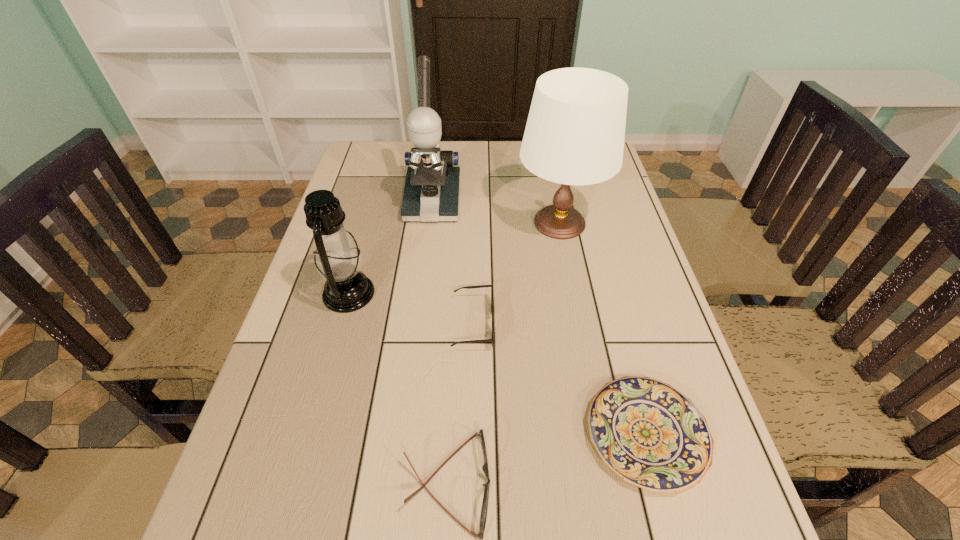
Image resolution: width=960 pixels, height=540 pixels. I want to click on blank area located on the back of the shortest object, so click(x=622, y=347).

Identify the location of object at the left edge. (337, 259).

This screenshot has height=540, width=960. Find the location of `lamp positioned at the right edge`. lamp positioned at the right edge is located at coordinates point(575,131).

At what (x,y) coordinates should I click in order to perform the action: click on plate that is positioned at the right edge. Please return your answer as a coordinate pair (x, y). Image resolution: width=960 pixels, height=540 pixels. Looking at the image, I should click on (651, 435).

Find the location of a particular element. This screenshot has width=960, height=540. blank space at the far edge of the desktop is located at coordinates (516, 160).

I want to click on vacant area at the near edge, so click(x=461, y=533).

In the image, there is a desktop. Where is `vacant space at the left edge`? The height and width of the screenshot is (540, 960). vacant space at the left edge is located at coordinates (322, 286).

Locate an element on the screen. This screenshot has width=960, height=540. free location at the right edge is located at coordinates point(610,328).

In order to click on vacant area at the far left corner in this screenshot , I will do `click(365, 149)`.

Locate an element on the screen. empty location between the sunglasses and the lamp is located at coordinates (516, 273).